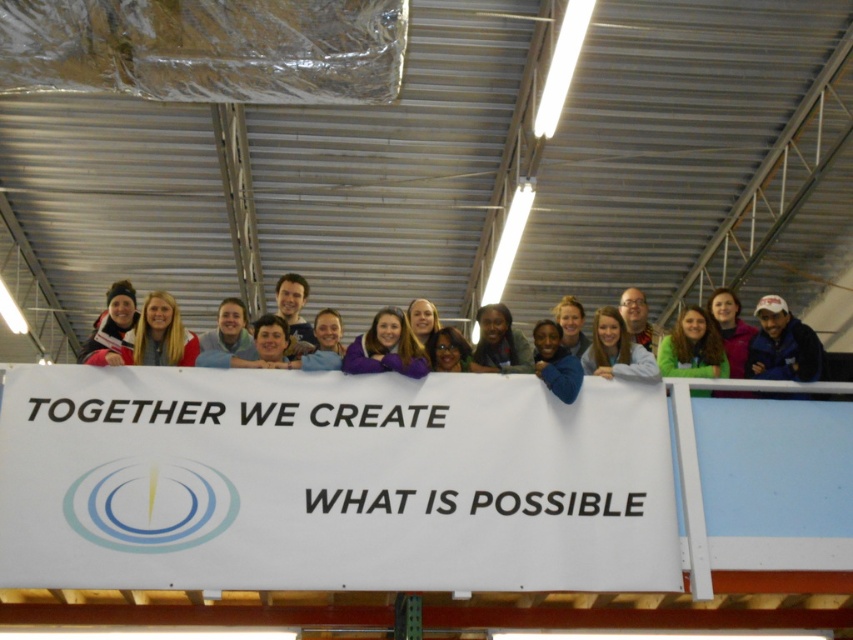
You are standing in the industrial space and want to take a photo of the matte purple sweater at center without the white paper banner at center blocking it. How can you adjust your position to achieve this?

Move behind the white paper banner at center so that the matte purple sweater at center is now in front of the banner, allowing you to capture the sweater without the banner obstructing it.